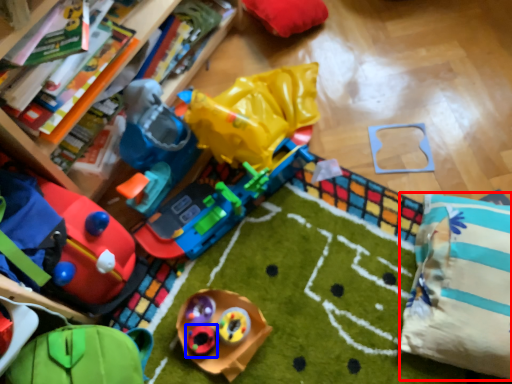
Question: Which object is further to the camera taking this photo, pillow (highlighted by a red box) or toy (highlighted by a blue box)?

Choices:
 (A) pillow
 (B) toy

Answer: (B)